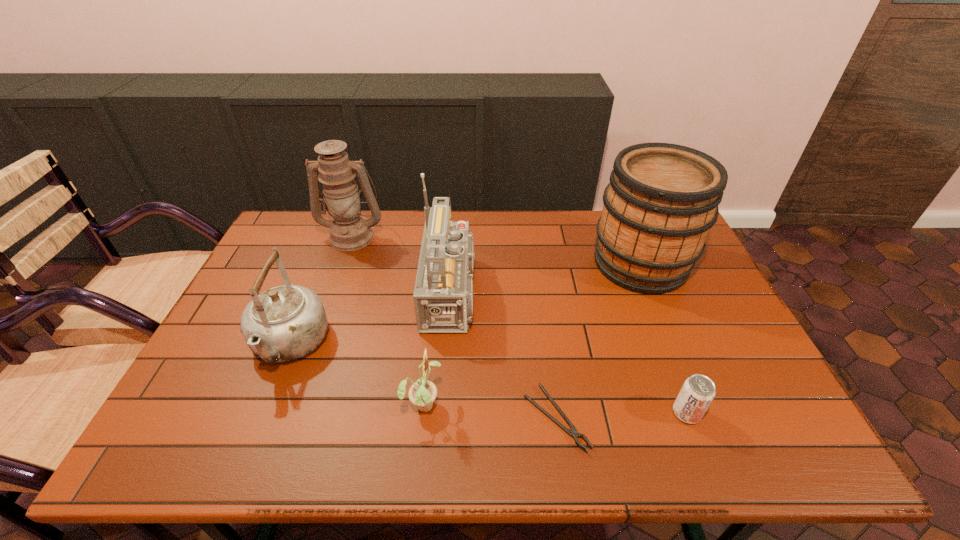
The height and width of the screenshot is (540, 960). What are the coordinates of `vacant area between the oil lamp and the fifth tallest object` in the screenshot? It's located at (388, 320).

The image size is (960, 540). What are the coordinates of `unoccupied position between the sunflower and the radio receiver` in the screenshot? It's located at (441, 348).

This screenshot has height=540, width=960. Find the location of `free spot between the cider and the soda can`. free spot between the cider and the soda can is located at coordinates (663, 338).

Locate an element on the screen. The height and width of the screenshot is (540, 960). vacant space in between the cider and the sunflower is located at coordinates (532, 333).

The height and width of the screenshot is (540, 960). Find the location of `blank region between the kettle and the soda can`. blank region between the kettle and the soda can is located at coordinates (488, 379).

I want to click on empty location between the sixth tallest object and the sunflower, so click(x=555, y=408).

Where is `empty space that is in between the radio receiver and the shortest object`? empty space that is in between the radio receiver and the shortest object is located at coordinates (507, 355).

Locate which object ranks third in proximity to the cider. Please provide its 2D coordinates. Your answer should be formatted as a tuple, i.e. [(x, y)], where the tuple contains the x and y coordinates of a point satisfying the conditions above.

[(698, 391)]

Locate an element on the screen. object that is the fifth closest to the soda can is located at coordinates (285, 323).

At what (x,y) coordinates should I click in order to perform the action: click on free space that satisfies the following two spatial constraints: 1. on the front-facing side of the soda can; 2. on the left side of the radio receiver. Please return your answer as a coordinate pair (x, y). This screenshot has height=540, width=960. Looking at the image, I should click on pyautogui.click(x=451, y=413).